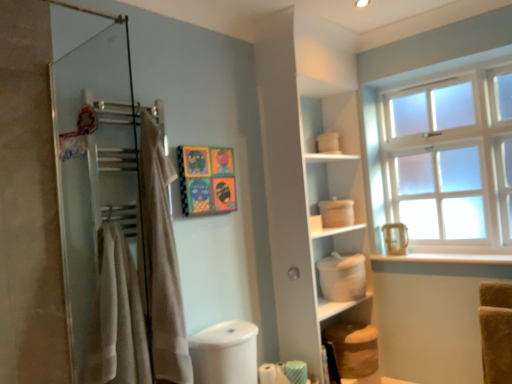
Question: From a real-world perspective, is beige fabric towel at left over beige cotton bath towel at left?

Choices:
 (A) yes
 (B) no

Answer: (A)

Question: Can you confirm if beige fabric towel at left is wider than beige cotton bath towel at left?

Choices:
 (A) yes
 (B) no

Answer: (B)

Question: Is beige fabric towel at left taller than beige cotton bath towel at left?

Choices:
 (A) no
 (B) yes

Answer: (B)

Question: Is beige fabric towel at left to the right of beige cotton bath towel at left from the viewer's perspective?

Choices:
 (A) yes
 (B) no

Answer: (A)

Question: Does beige fabric towel at left have a smaller size compared to beige cotton bath towel at left?

Choices:
 (A) no
 (B) yes

Answer: (A)

Question: Are beige fabric towel at left and beige cotton bath towel at left making contact?

Choices:
 (A) no
 (B) yes

Answer: (A)

Question: Considering the relative sizes of white matte window sill at lower right and green striped toilet paper at lower center, the 1th toilet paper from the right, in the image provided, is white matte window sill at lower right shorter than green striped toilet paper at lower center, the 1th toilet paper from the right,?

Choices:
 (A) no
 (B) yes

Answer: (B)

Question: From a real-world perspective, is white matte window sill at lower right on green striped toilet paper at lower center, the 1th toilet paper from the right?

Choices:
 (A) yes
 (B) no

Answer: (A)

Question: Can you confirm if white matte window sill at lower right is wider than green striped toilet paper at lower center, marked as the second toilet paper in a left-to-right arrangement?

Choices:
 (A) yes
 (B) no

Answer: (A)

Question: From a real-world perspective, is white matte window sill at lower right below green striped toilet paper at lower center, marked as the second toilet paper in a left-to-right arrangement?

Choices:
 (A) no
 (B) yes

Answer: (A)

Question: From the image's perspective, is white matte window sill at lower right over green striped toilet paper at lower center, marked as the second toilet paper in a left-to-right arrangement?

Choices:
 (A) no
 (B) yes

Answer: (B)

Question: From the image's perspective, would you say white matte window sill at lower right is shown under green striped toilet paper at lower center, the 1th toilet paper from the right?

Choices:
 (A) yes
 (B) no

Answer: (B)

Question: Is white matte window sill at lower right beside vibrant paper collage at center?

Choices:
 (A) yes
 (B) no

Answer: (B)